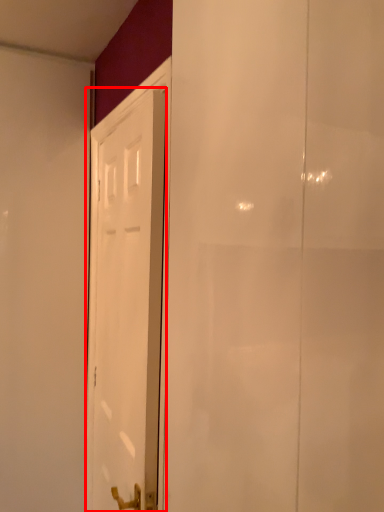
Question: Observing the image, what is the correct spatial positioning of door (annotated by the red box) in reference to screen door?

Choices:
 (A) left
 (B) right

Answer: (A)